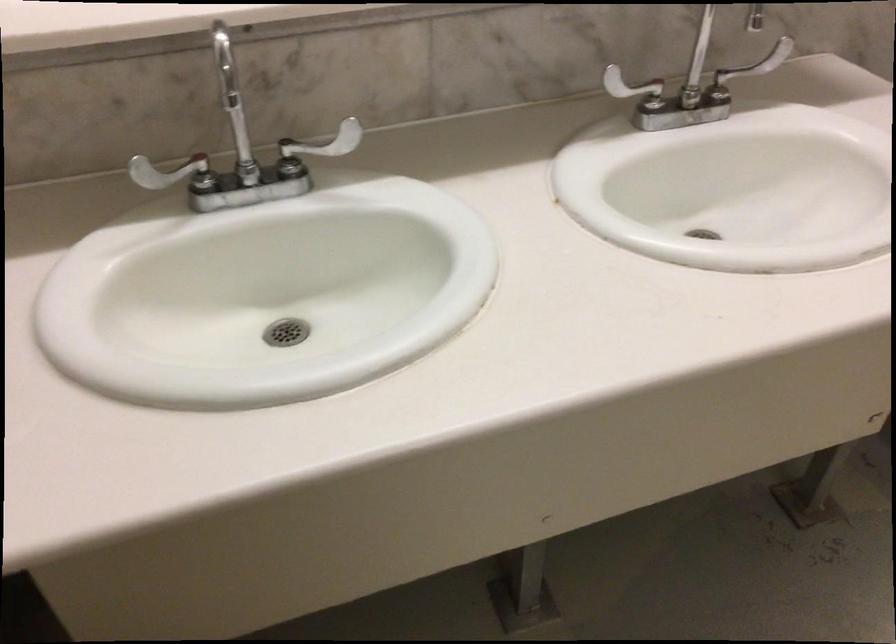
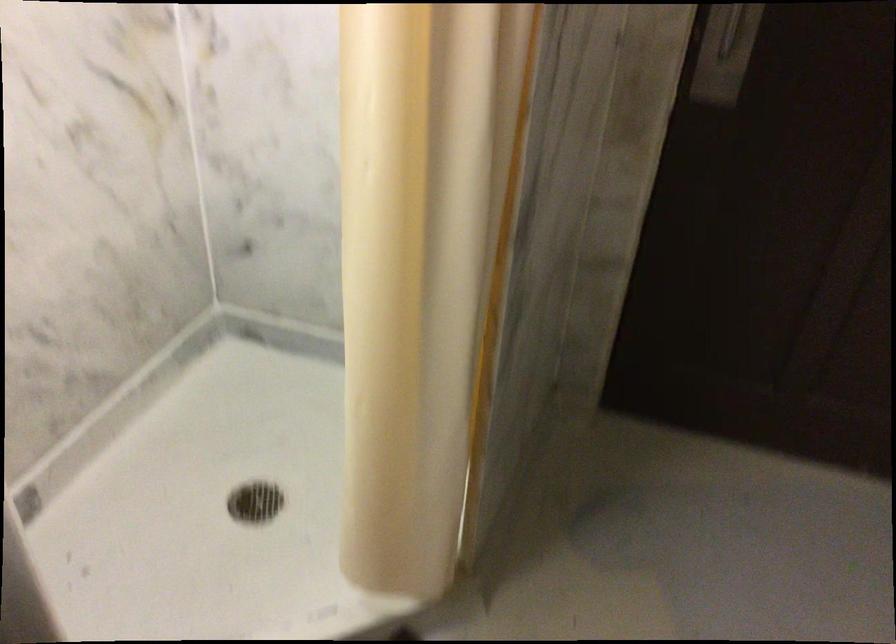
Question: The images are taken continuously from a first-person perspective. In which direction is your viewpoint rotating?

Choices:
 (A) Left
 (B) Right
 (C) Up
 (D) Down

Answer: (B)